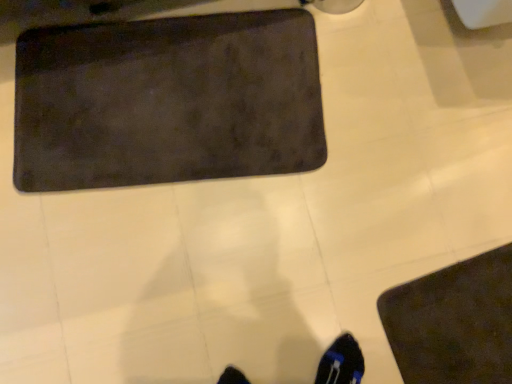
What are the coordinates of `dark matte mat at upper left` in the screenshot? It's located at (167, 101).

Image resolution: width=512 pixels, height=384 pixels. What do you see at coordinates (167, 101) in the screenshot?
I see `dark matte mat at upper left` at bounding box center [167, 101].

This screenshot has height=384, width=512. I want to click on dark matte mat at upper left, so click(167, 101).